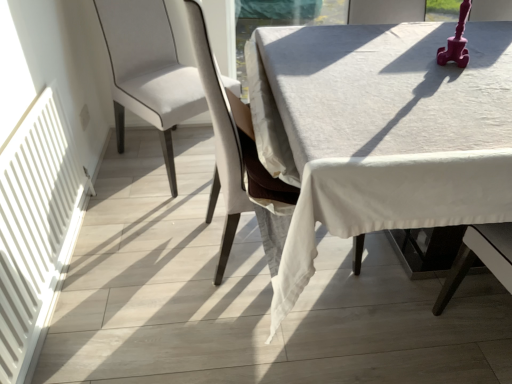
Locate an element on the screen. This screenshot has width=512, height=384. free region under satin white chair at center, which is the 2th chair in right-to-left order (from a real-world perspective) is located at coordinates (183, 159).